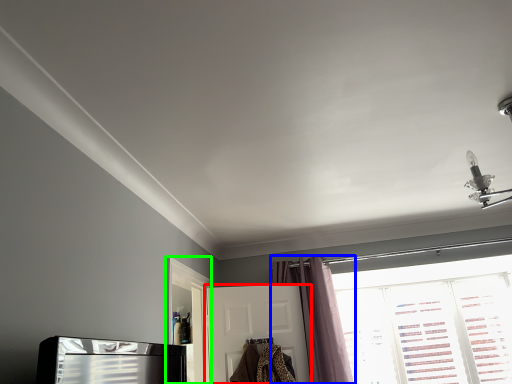
Question: Estimate the real-world distances between objects in this image. Which object is closer to door (highlighted by a red box), curtain (highlighted by a blue box) or screen door (highlighted by a green box)?

Choices:
 (A) curtain
 (B) screen door

Answer: (A)